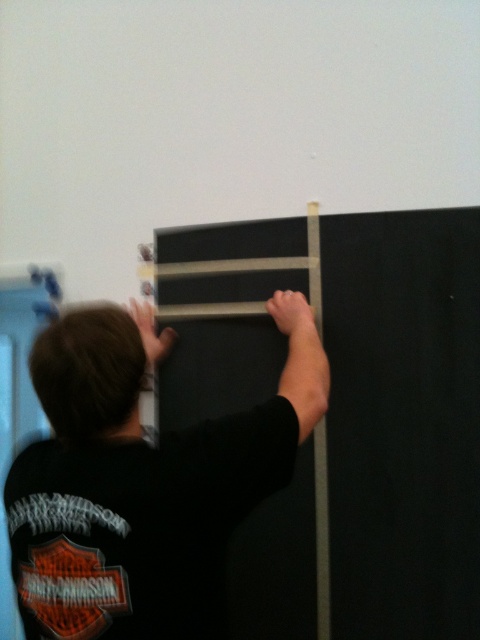
Which is below, black matte shirt at center or black matte ladder at center?

black matte ladder at center is lower down.

Is point (288, 474) in front of point (264, 339)?

That is True.

Between point (22, 608) and point (177, 307), which one is positioned in front?

Point (22, 608)

In order to click on black matte shirt at center in this screenshot , I will do `click(143, 481)`.